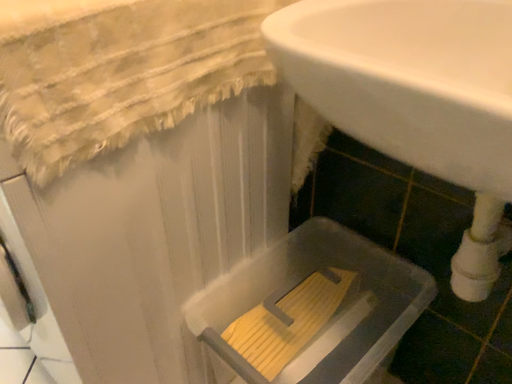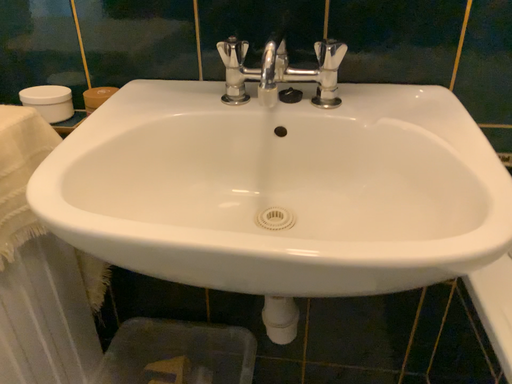
Question: Which way did the camera rotate in the video?

Choices:
 (A) rotated left
 (B) rotated right

Answer: (B)